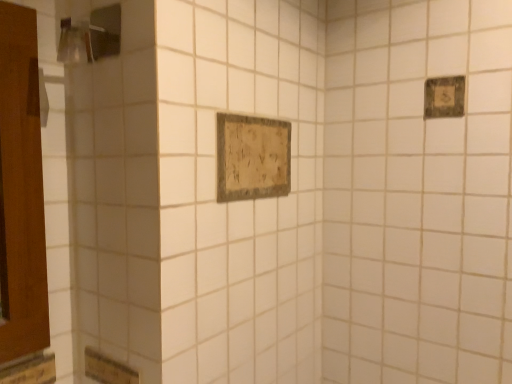
Question: From the image's perspective, relative to wooden plaque at upper right, acting as the first rectangle starting from the top, is distressed wood sign at center, acting as the second rectangle starting from the top, above or below?

Choices:
 (A) above
 (B) below

Answer: (B)

Question: Based on their sizes in the image, would you say distressed wood sign at center, arranged as the 1th rectangle when viewed from the left, is bigger or smaller than wooden plaque at upper right, which is the 2th rectangle from bottom to top?

Choices:
 (A) big
 (B) small

Answer: (A)

Question: Estimate the real-world distances between objects in this image. Which object is closer to the wooden plaque at upper right, which is the 1th rectangle in right-to-left order?

Choices:
 (A) distressed wood sign at center, which is the 1th rectangle in bottom-to-top order
 (B) brushed metal shower at upper left

Answer: (A)

Question: Which object is positioned closest to the wooden plaque at upper right, which is the 1th rectangle in right-to-left order?

Choices:
 (A) brushed metal shower at upper left
 (B) distressed wood sign at center, which is the 1th rectangle in bottom-to-top order

Answer: (B)